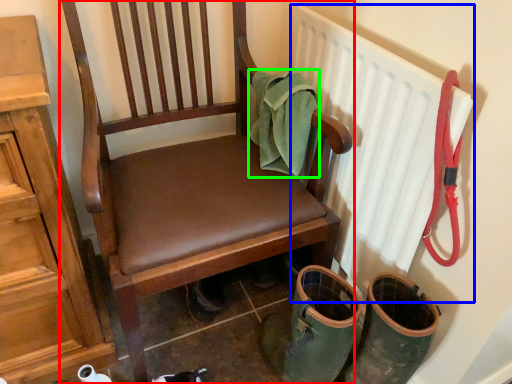
Question: Which object is positioned farthest from chair (highlighted by a red box)? Select from radiator (highlighted by a blue box) and material (highlighted by a green box).

Choices:
 (A) radiator
 (B) material

Answer: (A)